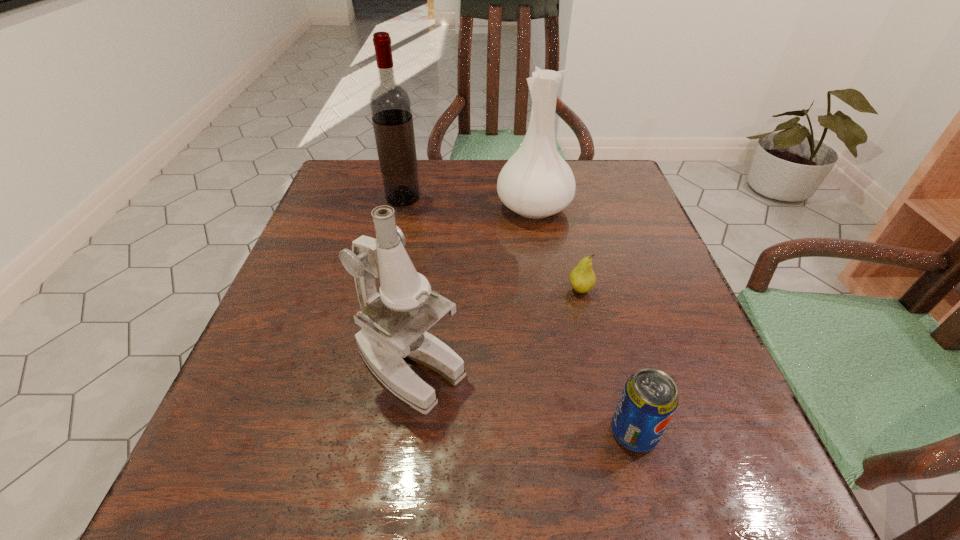
You are a GUI agent. You are given a task and a screenshot of the screen. Output one action in this format:
    pyautogui.click(x=<x>, y=<y>)
    Task: Click on the free location located on the right of the third farthest object
    
    Given the screenshot: What is the action you would take?
    pyautogui.click(x=660, y=289)

Locate an element on the screen. The width and height of the screenshot is (960, 540). wine bottle situated at the far edge is located at coordinates (390, 104).

Locate an element on the screen. The width and height of the screenshot is (960, 540). vase that is at the far edge is located at coordinates (536, 182).

The height and width of the screenshot is (540, 960). I want to click on object located at the near edge, so click(x=649, y=399).

The image size is (960, 540). Find the location of `object that is at the left edge`. object that is at the left edge is located at coordinates (390, 104).

Where is `object present at the right edge`? object present at the right edge is located at coordinates (649, 399).

This screenshot has height=540, width=960. Find the location of `object that is at the far left corner`. object that is at the far left corner is located at coordinates (390, 104).

Locate an element on the screen. object located at the near right corner is located at coordinates (649, 399).

Locate an element on the screen. The height and width of the screenshot is (540, 960). free point at the far edge is located at coordinates (414, 206).

Where is `free space at the near edge of the desktop`? free space at the near edge of the desktop is located at coordinates (441, 483).